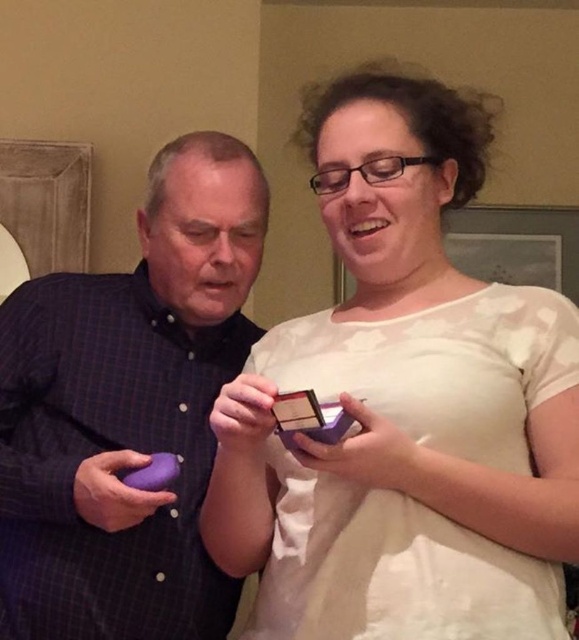
Who is more distant from viewer, (x=321, y=172) or (x=140, y=556)?

Positioned behind is point (x=140, y=556).

Does matte purple box at center have a larger size compared to purple matte phone at left?

Yes, matte purple box at center is bigger than purple matte phone at left.

Locate an element on the screen. The width and height of the screenshot is (579, 640). matte purple box at center is located at coordinates (404, 406).